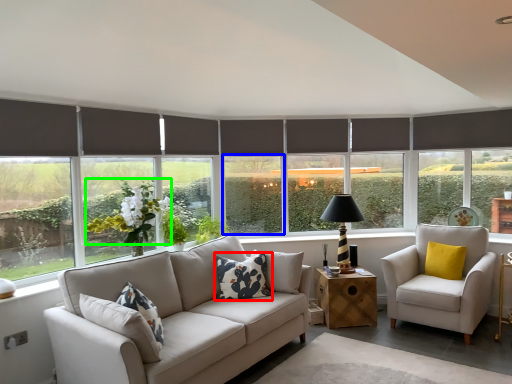
Question: Which is farther away from pillow (highlighted by a red box)? window screen (highlighted by a blue box) or flower (highlighted by a green box)?

Choices:
 (A) window screen
 (B) flower

Answer: (A)